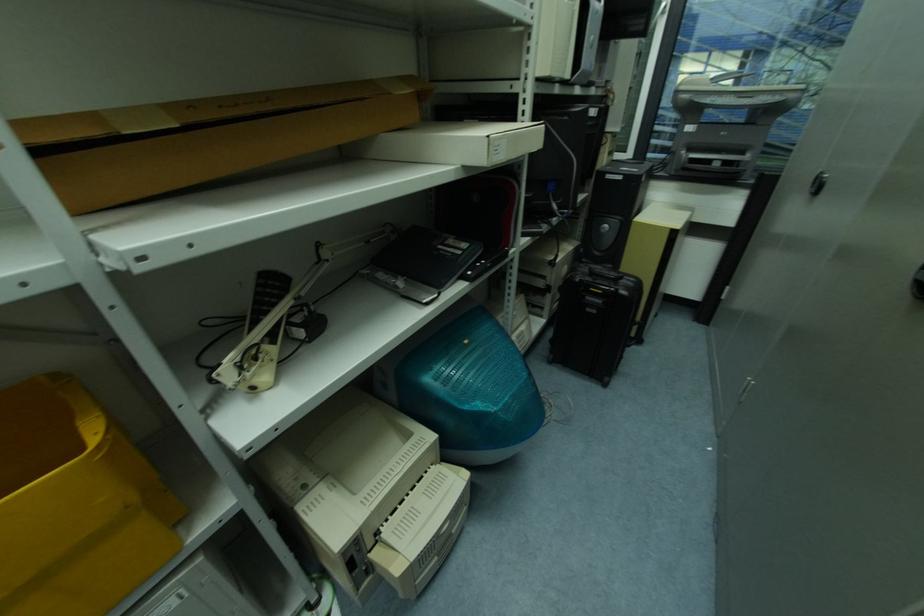
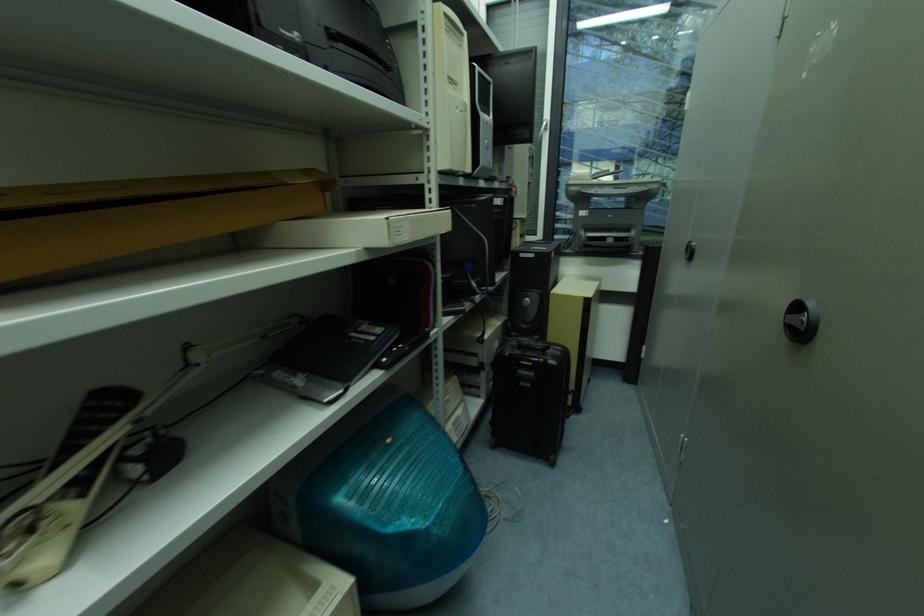
Question: How did the camera likely rotate?

Choices:
 (A) Left
 (B) Right
 (C) Up
 (D) Down

Answer: (C)